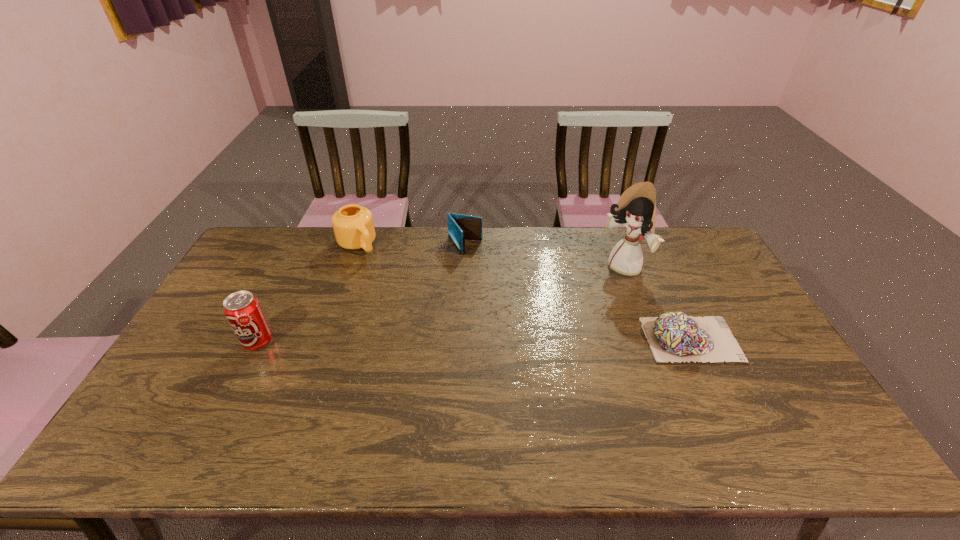
The height and width of the screenshot is (540, 960). Identify the location of object that is the closest one to the shortest object. coord(636,209).

Locate an element on the screen. The image size is (960, 540). vacant point that satisfies the following two spatial constraints: 1. on the front side of the second shortest object; 2. on the front, side, and top of the shortest object is located at coordinates (461, 339).

Identify the location of vacant region that satisfies the following two spatial constraints: 1. on the front side of the third object from left to right; 2. on the front, side, and top of the cap. (461, 339).

I want to click on free location that satisfies the following two spatial constraints: 1. on the front side of the second shortest object; 2. on the front, side, and top of the cap, so click(x=461, y=339).

This screenshot has width=960, height=540. What are the coordinates of `free location that satisfies the following two spatial constraints: 1. on the front side of the tallest object; 2. on the front, side, and top of the cap` in the screenshot? It's located at (651, 339).